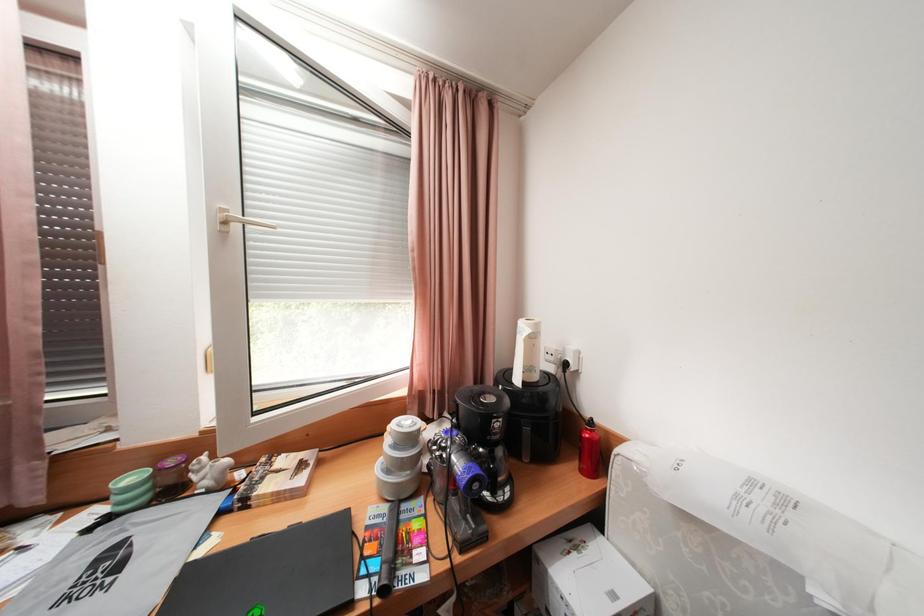
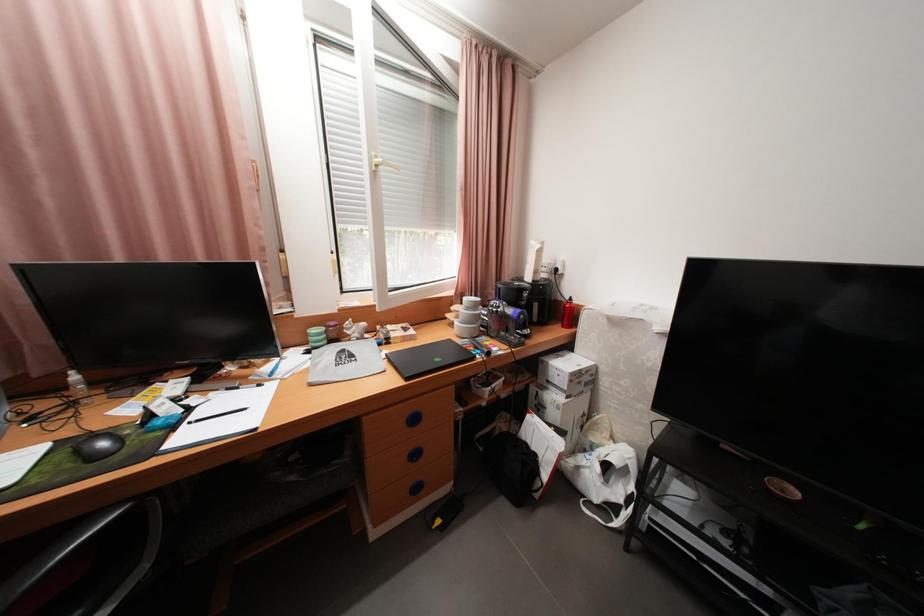
In a continuous first-person perspective shot, in which direction is the camera moving?

The movement direction of the cameraman is left, backward.